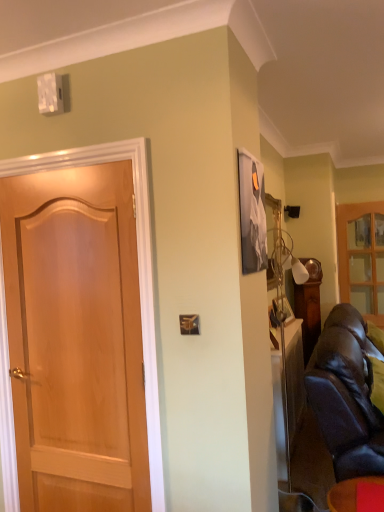
Question: Does point (102, 386) appear closer or farther from the camera than point (340, 243)?

Choices:
 (A) closer
 (B) farther

Answer: (A)

Question: Is light brown wood door at left taller or shorter than wooden glass cabinet at right?

Choices:
 (A) tall
 (B) short

Answer: (A)

Question: Which of these objects is positioned closest to the matte black leather couch at lower right?

Choices:
 (A) wooden glass cabinet at right
 (B) light brown wood door at left
 (C) leather couch at right

Answer: (C)

Question: Which object is positioned farthest from the wooden glass cabinet at right?

Choices:
 (A) light brown wood door at left
 (B) matte black leather couch at lower right
 (C) leather couch at right

Answer: (A)